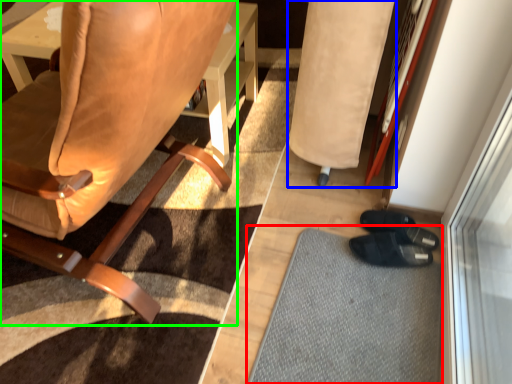
Question: Estimate the real-world distances between objects in this image. Which object is farther from doormat (highlighted by a red box), bean bag chair (highlighted by a blue box) or chair (highlighted by a green box)?

Choices:
 (A) bean bag chair
 (B) chair

Answer: (B)